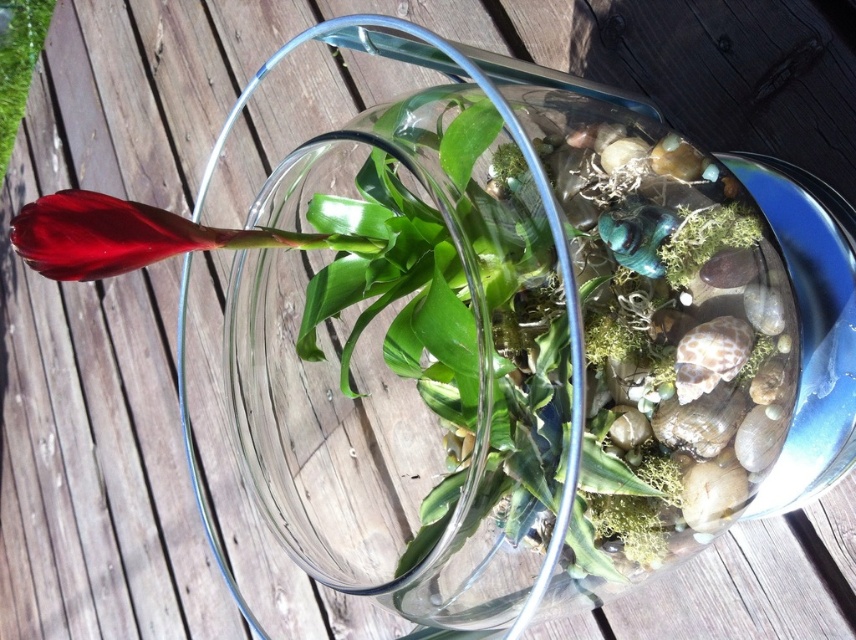
Is point (248, 248) in front of point (40, 17)?

Yes, point (248, 248) is closer to viewer.

Which is more to the right, glossy red flower at left or matte green leaf at upper left?

Positioned to the right is glossy red flower at left.

I want to click on glossy red flower at left, so click(135, 236).